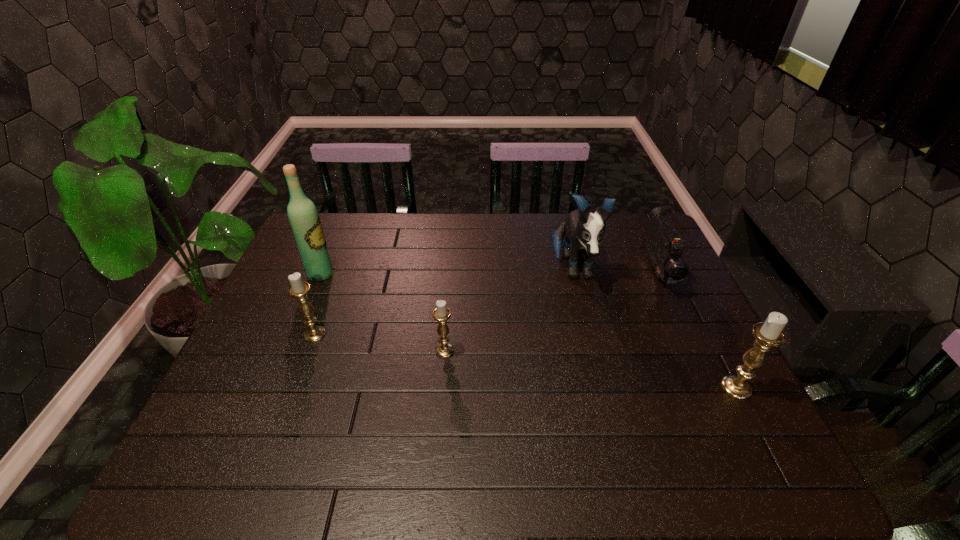
The image size is (960, 540). In order to click on wine bottle that is at the left edge in this screenshot , I will do `click(304, 219)`.

What are the coordinates of `candle holder present at the right edge` in the screenshot? It's located at (768, 334).

I want to click on camcorder located in the right edge section of the desktop, so click(x=664, y=245).

Identify the location of object at the far right corner. (664, 245).

I want to click on object present at the near right corner, so click(x=768, y=334).

In the image, there is a desktop. Where is `vacant area at the far edge`? vacant area at the far edge is located at coordinates (535, 226).

Where is `free location at the near edge of the desktop`? This screenshot has height=540, width=960. free location at the near edge of the desktop is located at coordinates 617,407.

In the image, there is a desktop. Where is `free space at the left edge`? The width and height of the screenshot is (960, 540). free space at the left edge is located at coordinates (265, 308).

At what (x,y) coordinates should I click in order to perform the action: click on vacant space at the right edge of the desktop. Please return your answer as a coordinate pair (x, y). This screenshot has height=540, width=960. Looking at the image, I should click on (713, 382).

This screenshot has width=960, height=540. What are the coordinates of `vacant space at the far left corner` in the screenshot? It's located at (342, 224).